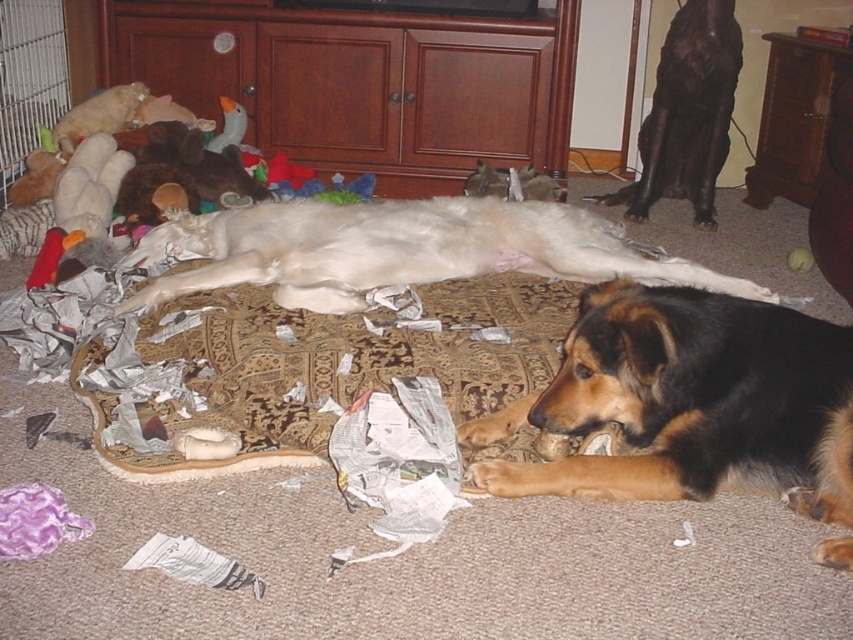
Does point (698, 420) come behind point (375, 228)?

No, it is in front of (375, 228).

Between point (740, 300) and point (408, 236), which one is positioned in front?

Point (740, 300) is in front.

This screenshot has width=853, height=640. What are the coordinates of `brown fur dog at center` in the screenshot? It's located at (688, 403).